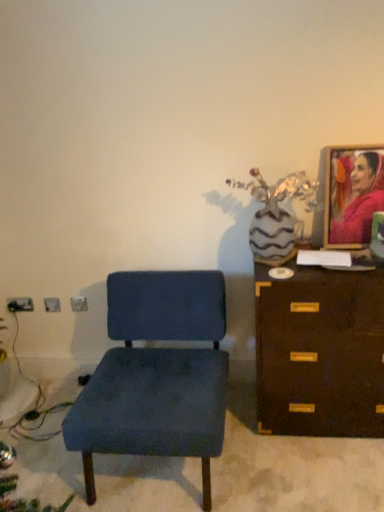
You are a GUI agent. You are given a task and a screenshot of the screen. Output one action in this format:
    pyautogui.click(x=<x>, y=<y>)
    Task: Click on the free spot to the right of velvet blue chair at center
    
    Given the screenshot: What is the action you would take?
    pyautogui.click(x=292, y=470)